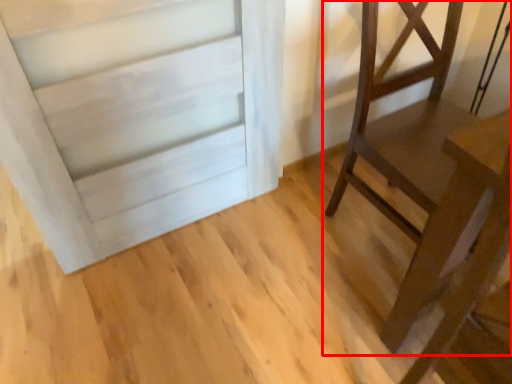
Question: Observing the image, what is the correct spatial positioning of furniture (annotated by the red box) in reference to table?

Choices:
 (A) left
 (B) right

Answer: (B)